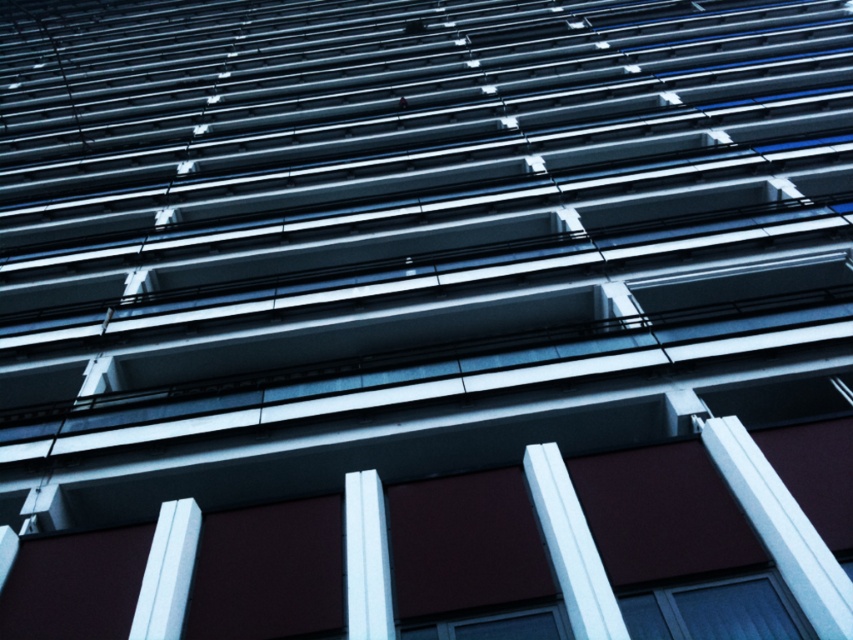
You are an architect reviewing the building design. The point at coordinate (x=572, y=547) is part of the structure. Which object in the scene does this point belong to?

The point at coordinate (x=572, y=547) belongs to the white smooth pillar at lower center.

You are an architect inspecting the building facade. You notice two pillars, the white smooth pillar at lower center and the white glossy pillar at center. Which pillar is positioned higher up in the image?

The white smooth pillar at lower center is positioned higher up in the image than the white glossy pillar at center.

In the scene shown: You are an architect reviewing the building facade design. You notice two points marked on the facade at coordinates point [567,563] and point [374,598]. Which of these points is closer to the viewer?

Point [567,563] is closer to the viewer than point [374,598].